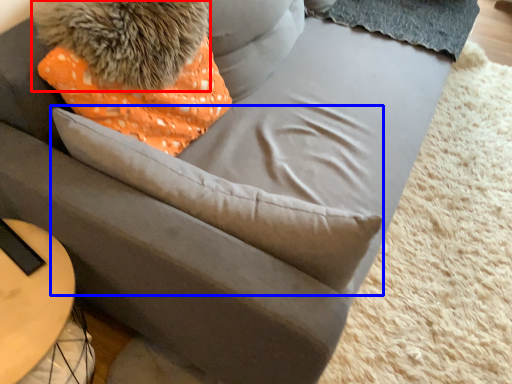
Question: Which point is closer to the camera, animal (highlighted by a red box) or throw pillow (highlighted by a blue box)?

Choices:
 (A) animal
 (B) throw pillow

Answer: (B)